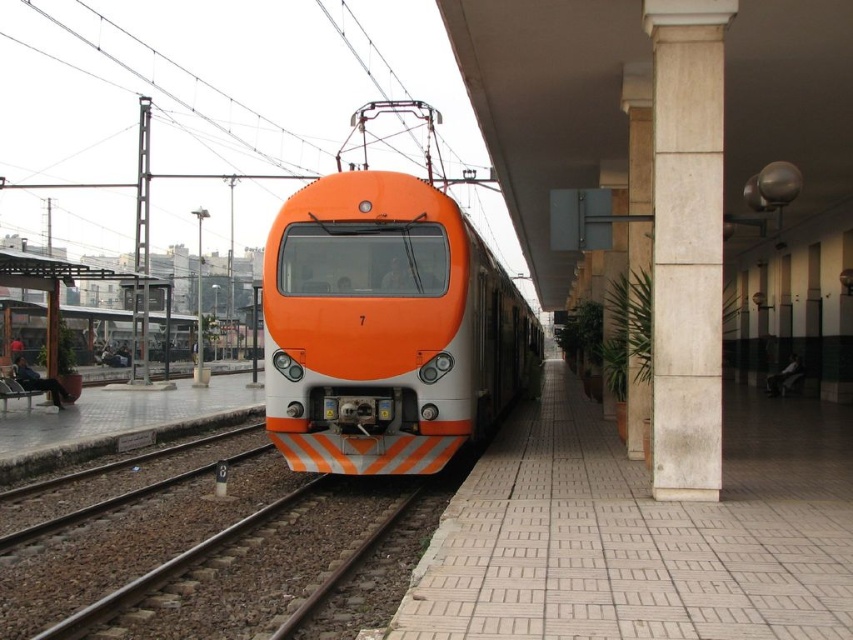
Is white tile platform at center bigger than orange glossy train at center?

No, white tile platform at center is not bigger than orange glossy train at center.

Who is taller, white tile platform at center or orange glossy train at center?

orange glossy train at center is taller.

Which is behind, point (618, 445) or point (363, 385)?

Positioned behind is point (618, 445).

Where is `white tile platform at center`? Image resolution: width=853 pixels, height=640 pixels. white tile platform at center is located at coordinates (641, 534).

Between white tile platform at center and brown gravel train track at lower left, which one appears on the right side from the viewer's perspective?

From the viewer's perspective, white tile platform at center appears more on the right side.

Does white tile platform at center lie in front of brown gravel train track at lower left?

Yes, it is in front of brown gravel train track at lower left.

I want to click on white tile platform at center, so click(x=641, y=534).

Does orange glossy train at center have a lesser height compared to white marble column at right?

Yes.

This screenshot has height=640, width=853. In order to click on orange glossy train at center in this screenshot , I will do click(x=386, y=326).

This screenshot has width=853, height=640. What are the coordinates of `orange glossy train at center` in the screenshot? It's located at (386, 326).

The image size is (853, 640). Find the location of `orange glossy train at center`. orange glossy train at center is located at coordinates (386, 326).